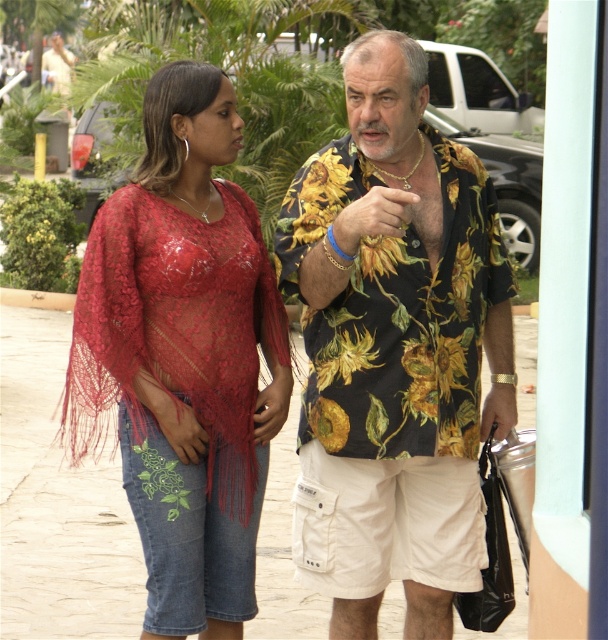
Question: Which object is positioned closest to the lace fabric top at left?

Choices:
 (A) smooth concrete pavement at center
 (B) gold metallic bracelet at upper center

Answer: (B)

Question: Is lace fabric top at left to the left of gold metallic bracelet at upper center from the viewer's perspective?

Choices:
 (A) yes
 (B) no

Answer: (A)

Question: Is denim shorts at lower left to the right of gold metallic bracelet at upper center from the viewer's perspective?

Choices:
 (A) yes
 (B) no

Answer: (B)

Question: In this image, where is smooth concrete pavement at center located relative to denim shorts at lower left?

Choices:
 (A) right
 (B) left

Answer: (B)

Question: Which object is closer to the camera taking this photo?

Choices:
 (A) lace fabric top at left
 (B) floral-patterned shirt at center

Answer: (B)

Question: Which point is farther to the camera?

Choices:
 (A) floral-patterned shirt at center
 (B) denim shorts at lower left
 (C) smooth concrete pavement at center
 (D) lace fabric top at left

Answer: (C)